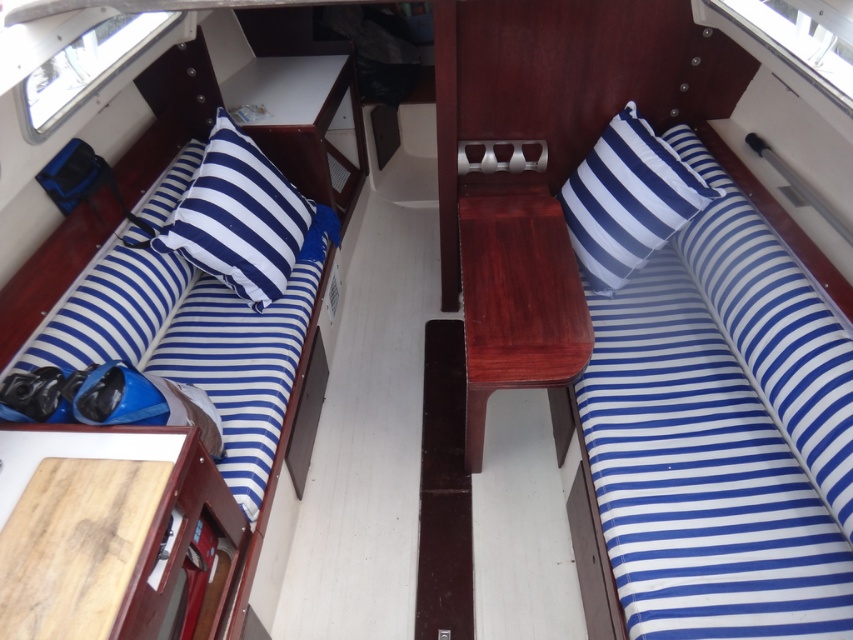
Question: Does blue striped pillow at left appear on the left side of blue striped cushion at upper right?

Choices:
 (A) yes
 (B) no

Answer: (A)

Question: Which object is farther from the camera taking this photo?

Choices:
 (A) blue striped pillow at left
 (B) blue striped cushion at upper right

Answer: (A)

Question: Which of the following is the farthest from the observer?

Choices:
 (A) (277, 220)
 (B) (618, 177)

Answer: (A)

Question: Can you confirm if blue striped pillow at left is positioned below blue striped cushion at upper right?

Choices:
 (A) yes
 (B) no

Answer: (A)

Question: Is blue striped pillow at left behind blue striped cushion at upper right?

Choices:
 (A) no
 (B) yes

Answer: (B)